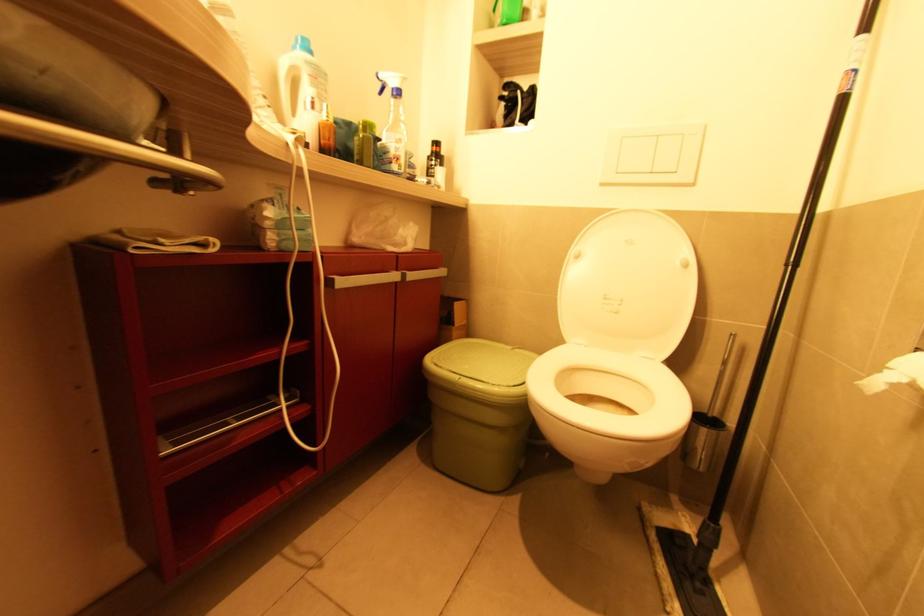
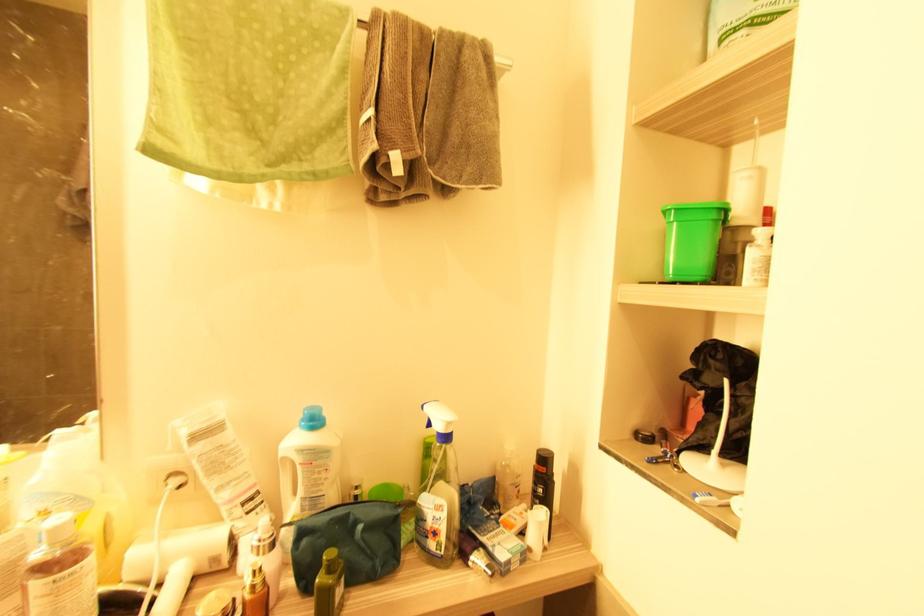
Find the pixel in the second image that matches the point at 393,163 in the first image.

(429, 539)